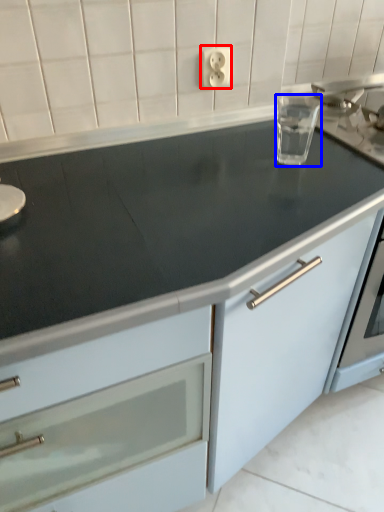
Question: Which of the following is the closest to the observer, electric outlet (highlighted by a red box) or appliance (highlighted by a blue box)?

Choices:
 (A) electric outlet
 (B) appliance

Answer: (B)